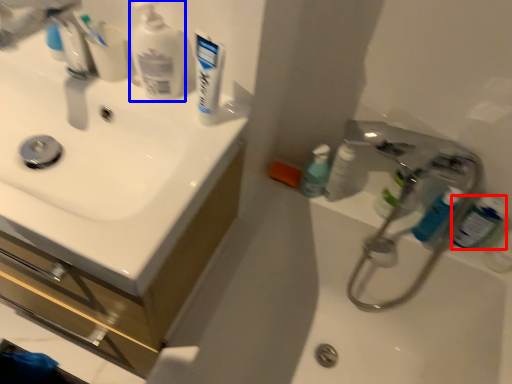
Question: Which object appears closest to the camera in this image, mouthwash (highlighted by a red box) or cleaning product (highlighted by a blue box)?

Choices:
 (A) mouthwash
 (B) cleaning product

Answer: (B)